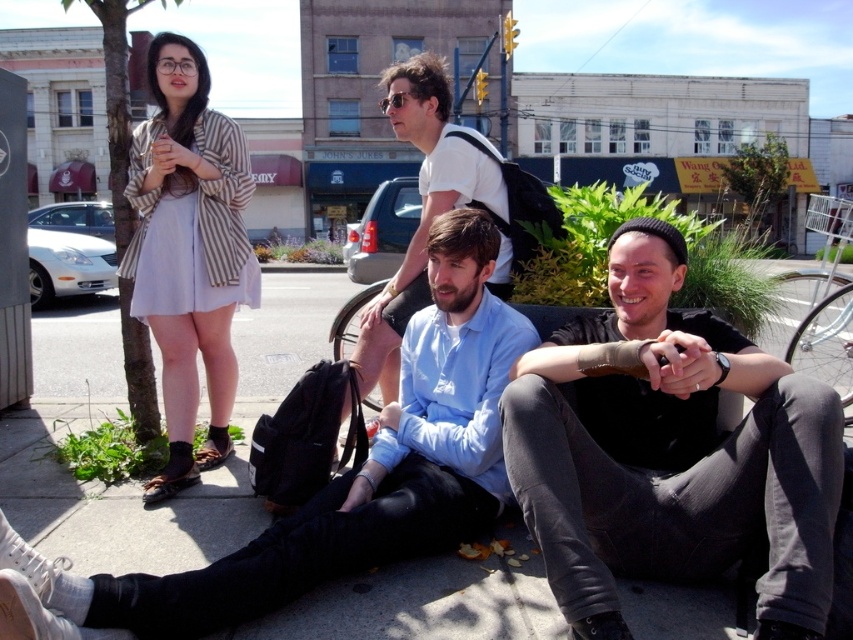
Who is taller, light blue cotton shirt at center or striped fabric dress at upper left?

With more height is striped fabric dress at upper left.

Is light blue cotton shirt at center to the right of striped fabric dress at upper left from the viewer's perspective?

Yes, light blue cotton shirt at center is to the right of striped fabric dress at upper left.

Identify the location of light blue cotton shirt at center. The image size is (853, 640). (339, 477).

You are a GUI agent. You are given a task and a screenshot of the screen. Output one action in this format:
    pyautogui.click(x=<x>, y=<y>)
    Task: Click on the light blue cotton shirt at center
    
    Given the screenshot: What is the action you would take?
    pyautogui.click(x=339, y=477)

Who is positioned more to the right, black matte shirt at center or striped fabric dress at upper left?

black matte shirt at center is more to the right.

Between black matte shirt at center and striped fabric dress at upper left, which one appears on the left side from the viewer's perspective?

Positioned to the left is striped fabric dress at upper left.

Between point (612, 380) and point (170, 234), which one is positioned behind?

Positioned behind is point (170, 234).

This screenshot has width=853, height=640. I want to click on black matte shirt at center, so click(x=670, y=452).

From the picture: Is black matte shirt at center closer to the viewer compared to light blue shirt at center?

Yes, black matte shirt at center is closer to the viewer.

The image size is (853, 640). I want to click on black matte shirt at center, so click(x=670, y=452).

The width and height of the screenshot is (853, 640). I want to click on black matte shirt at center, so click(670, 452).